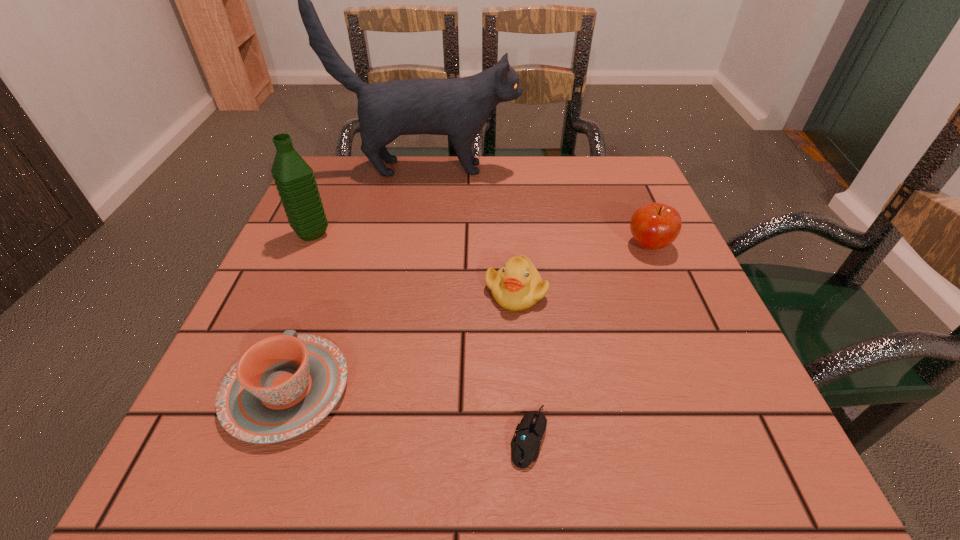
Find the location of `free space between the tallest object and the water bottle`. free space between the tallest object and the water bottle is located at coordinates (370, 201).

Find the location of a particular element. The image size is (960, 540). vacant area that lies between the water bottle and the duckling is located at coordinates (414, 262).

Find the location of a particular element. The height and width of the screenshot is (540, 960). vacant area that lies between the water bottle and the chinaware is located at coordinates (300, 311).

Find the location of a particular element. The image size is (960, 540). vacant space that is in between the fifth shortest object and the tallest object is located at coordinates (370, 201).

This screenshot has width=960, height=540. I want to click on unoccupied position between the rightmost object and the duckling, so click(583, 268).

The width and height of the screenshot is (960, 540). I want to click on vacant area that lies between the second tallest object and the apple, so click(x=480, y=239).

The image size is (960, 540). What are the coordinates of `empty space that is in between the apple and the second tallest object` in the screenshot? It's located at (480, 239).

The height and width of the screenshot is (540, 960). I want to click on free space between the chinaware and the tallest object, so click(x=357, y=279).

Where is `free area in between the duckling and the second shortest object`? The height and width of the screenshot is (540, 960). free area in between the duckling and the second shortest object is located at coordinates (401, 340).

You are a GUI agent. You are given a task and a screenshot of the screen. Output one action in this format:
    pyautogui.click(x=<x>, y=<y>)
    Task: Click on the free space that is in between the computer mouse and the duckling
    This screenshot has height=540, width=960.
    Given the screenshot: What is the action you would take?
    pyautogui.click(x=522, y=364)